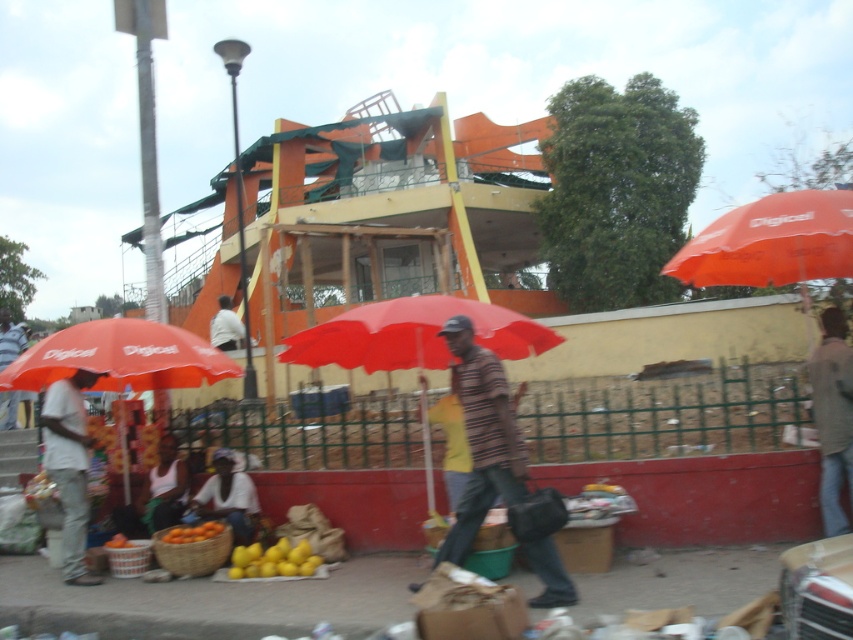
You are a photographer trying to capture a wide shot of the orange fabric umbrella at upper right and the denim jacket at lower right. Given that your camera can only focus on objects within a 3 meter width, will both objects fit in the frame?

The orange fabric umbrella at upper right is wider than the denim jacket at lower right. However, since the camera can focus on objects within a 3 meter width, both objects will fit in the frame as long as their combined width does not exceed 3 meters. The exact dimensions are not provided, so we cannot confirm if they fit without additional information.

You are standing at point (173, 540) and want to walk to point (61, 496). Is the destination behind you or in front of you?

The destination point (61, 496) is behind you since it is located behind point (173, 540) where you are standing.

You are a customer at the market and want to buy an umbrella and a jacket. You notice the orange fabric umbrella at upper right and the denim jacket at lower right. Which item is taller when comparing their heights?

The denim jacket at lower right is taller than the orange fabric umbrella at upper right.